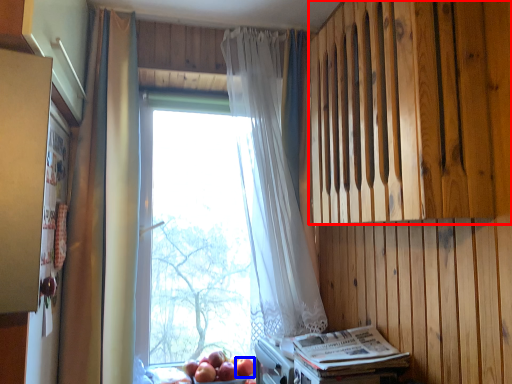
Question: Which of the following is the farthest to the observer, wood (highlighted by a red box) or apple (highlighted by a blue box)?

Choices:
 (A) wood
 (B) apple

Answer: (B)